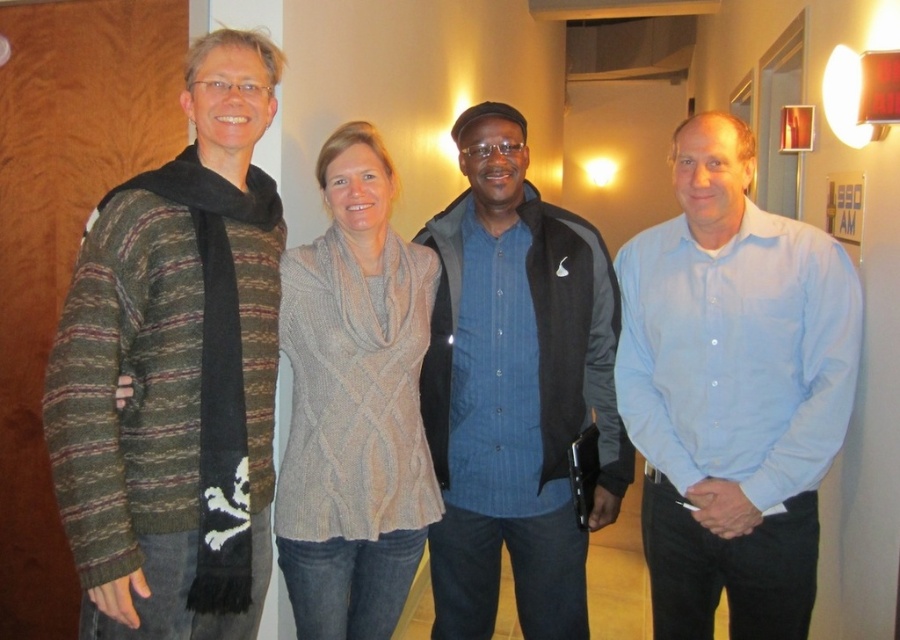
Does point (796, 561) lie behind point (324, 266)?

Yes, point (796, 561) is farther from viewer.

Describe the element at coordinates (734, 392) in the screenshot. I see `light blue shirt at right` at that location.

Locate an element on the screen. This screenshot has height=640, width=900. light blue shirt at right is located at coordinates (734, 392).

Describe the element at coordinates (734, 392) in the screenshot. This screenshot has width=900, height=640. I see `light blue shirt at right` at that location.

Between point (732, 234) and point (531, 589), which one is positioned in front?

Point (732, 234)

Where is `light blue shirt at right`? The image size is (900, 640). light blue shirt at right is located at coordinates (734, 392).

Is point (626, 486) in front of point (284, 532)?

No, it is not.

Does blue button-up shirt at center have a greater height compared to knitted gray scarf at center?

Yes, blue button-up shirt at center is taller than knitted gray scarf at center.

You are a GUI agent. You are given a task and a screenshot of the screen. Output one action in this format:
    pyautogui.click(x=<x>, y=<y>)
    Task: Click on the blue button-up shirt at center
    The width and height of the screenshot is (900, 640).
    Given the screenshot: What is the action you would take?
    pyautogui.click(x=515, y=388)